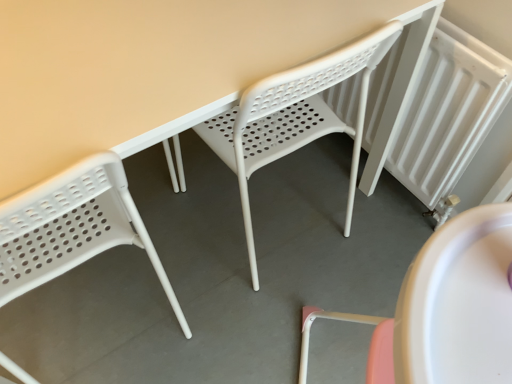
At what (x,y) coordinates should I click in order to perform the action: click on free space between white plastic chair at center, which appears as the 1th chair when viewed from the right, and white textured radiator at right. Please return your answer as a coordinate pair (x, y). The width and height of the screenshot is (512, 384). Looking at the image, I should click on (354, 213).